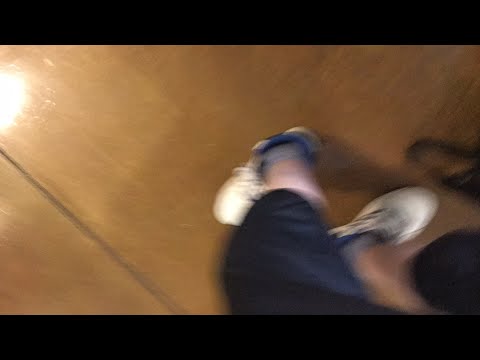
The width and height of the screenshot is (480, 360). I want to click on tile floor, so click(x=67, y=175).